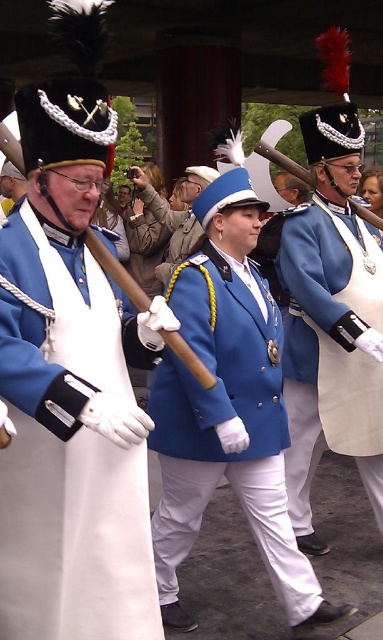
The width and height of the screenshot is (383, 640). Identify the location of white matte uniform at left. (78, 540).

Does white matte uniform at left have a lesser width compared to matte blue coat at center?

Correct, white matte uniform at left's width is less than matte blue coat at center's.

Find the location of a particular element. white matte uniform at left is located at coordinates (78, 540).

Consider the image. Does matte blue jacket at center appear over matte blue coat at center?

Incorrect, matte blue jacket at center is not positioned above matte blue coat at center.

Based on the photo, is matte blue jacket at center closer to the viewer compared to matte blue coat at center?

Yes, matte blue jacket at center is in front of matte blue coat at center.

Is point (214, 394) farther from viewer compared to point (304, 406)?

No, it is in front of (304, 406).

Locate an element on the screen. matte blue jacket at center is located at coordinates (222, 422).

Does white matte uniform at left have a lesser width compared to matte blue jacket at center?

Correct, white matte uniform at left's width is less than matte blue jacket at center's.

Is the position of white matte uniform at left more distant than that of matte blue jacket at center?

No.

Where is `white matte uniform at left`? The width and height of the screenshot is (383, 640). white matte uniform at left is located at coordinates (78, 540).